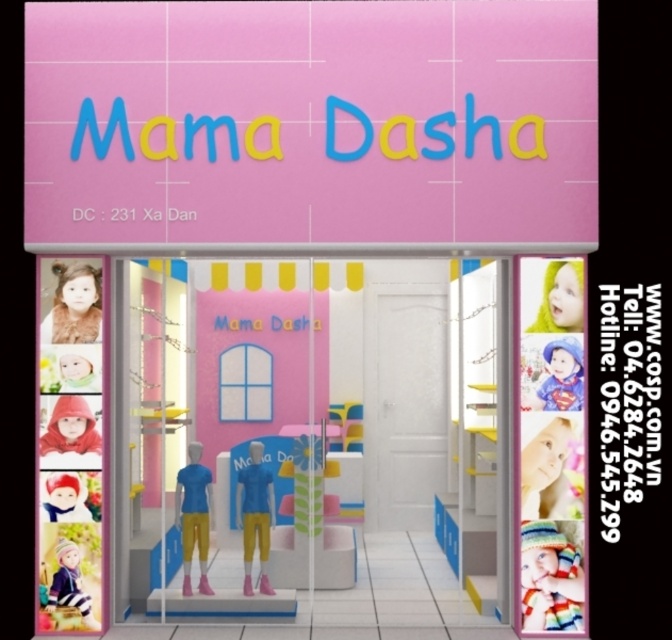
Who is positioned more to the left, pink glossy shop window at center or matte blue fabric doll at center?

matte blue fabric doll at center is more to the left.

From the picture: Does pink glossy shop window at center have a smaller size compared to matte blue fabric doll at center?

No, pink glossy shop window at center is not smaller than matte blue fabric doll at center.

Does point (370, 280) lie in front of point (194, 536)?

That is False.

At what (x,y) coordinates should I click in order to perform the action: click on pink glossy shop window at center. Please return your answer as a coordinate pair (x, y). The height and width of the screenshot is (640, 672). Looking at the image, I should click on (284, 417).

Where is `matte blue doll at center`? matte blue doll at center is located at coordinates (255, 515).

Between point (243, 516) and point (62, 449), which one is positioned in front?

Point (62, 449) is more forward.

Image resolution: width=672 pixels, height=640 pixels. Find the location of `matte blue doll at center`. matte blue doll at center is located at coordinates (255, 515).

Does striped woolen hat at lower left have a larger size compared to white plush barbie at lower left?

Correct, striped woolen hat at lower left is larger in size than white plush barbie at lower left.

Where is `striped woolen hat at lower left`? This screenshot has width=672, height=640. striped woolen hat at lower left is located at coordinates (69, 584).